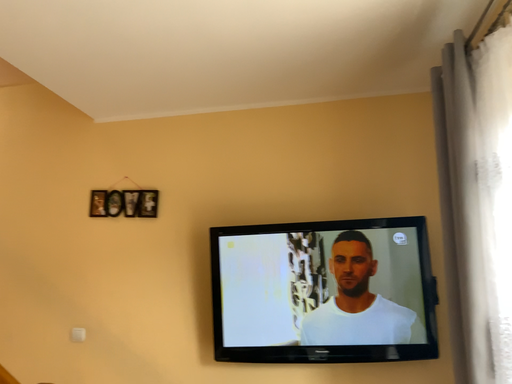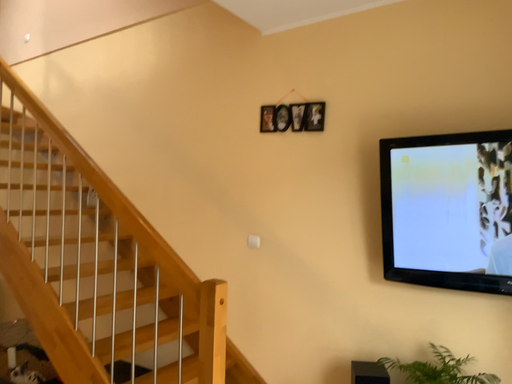
Question: Which way did the camera rotate in the video?

Choices:
 (A) rotated upward
 (B) rotated downward

Answer: (B)